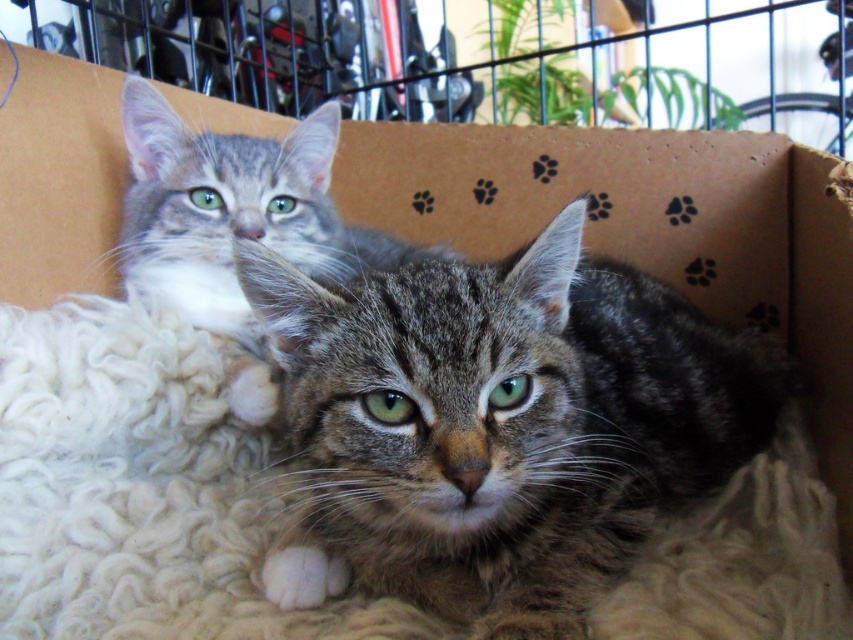
You are a photographer trying to capture the tabby fur cat at center. The camera has a focus point at coordinate point [500,426]. Will the focus point align with the cat?

The tabby fur cat at center is located at point [500,426], so yes, the focus point will align with the cat.

You are observing two cats in a cardboard box. Based on their positions, which cat is more to the right, the tabby fur cat at center or the tabby fur cat at upper left?

The tabby fur cat at center is positioned on the right side of the tabby fur cat at upper left, so the tabby fur cat at center is more to the right.

You are a photographer trying to capture a closeup of the tabby fur cat at center. The camera is set at a focal length of 50mm. To ensure the cat fills the frame, you need to position the camera so that the cat is centered in the viewfinder. Given the cat is at coordinates point 0.666, 0.587, will the cat be centered in the viewfinder if you aim the camera at the center of the box?

The tabby fur cat at center is located at point (x=500, y=426), which is not the exact center of the box. Therefore, the cat will not be centered in the viewfinder if you aim the camera at the center of the box.